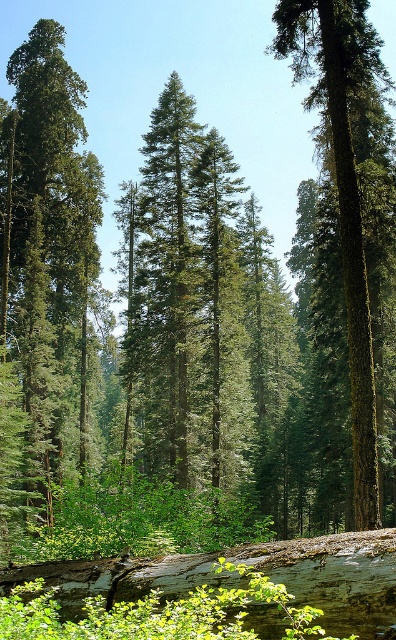
Based on the photo, how far apart are green rough bark tree at left and green mossy tree at center?

The distance of green rough bark tree at left from green mossy tree at center is 36.34 feet.

Which of these two, green rough bark tree at left or green mossy tree at center, stands shorter?

With less height is green mossy tree at center.

Locate an element on the screen. green rough bark tree at left is located at coordinates (47, 253).

At what (x,y) coordinates should I click in order to perform the action: click on green rough bark tree at left. Please return your answer as a coordinate pair (x, y). Looking at the image, I should click on (47, 253).